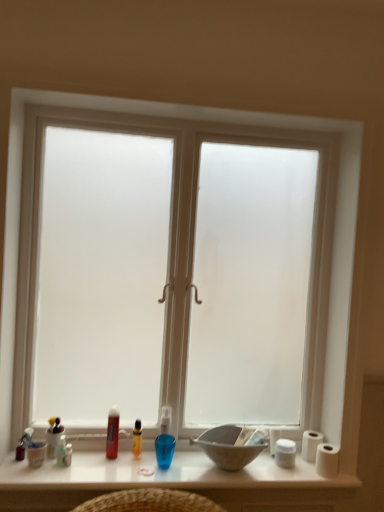
This screenshot has width=384, height=512. What are the coordinates of `vacant space that's between translucent plastic bottle at lower left, which appears as the third toiletry when viewed from the right, and translucent plastic bottle at center, arranged as the 1th toiletry when viewed from the right` in the screenshot? It's located at (99, 461).